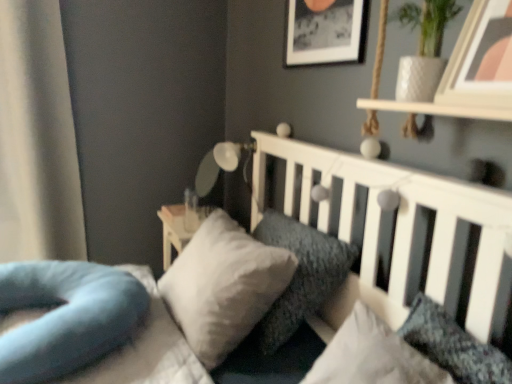
Question: Is white glossy lamp at upper center not close to soft gray pillow at center, which is counted as the 2th pillow, starting from the right?

Choices:
 (A) no
 (B) yes

Answer: (A)

Question: From the image's perspective, does white glossy lamp at upper center appear higher than soft gray pillow at center, arranged as the 3th pillow when viewed from the left?

Choices:
 (A) no
 (B) yes

Answer: (B)

Question: Does white glossy lamp at upper center have a lesser width compared to soft gray pillow at center, arranged as the 3th pillow when viewed from the left?

Choices:
 (A) no
 (B) yes

Answer: (B)

Question: Considering the relative sizes of white glossy lamp at upper center and soft gray pillow at center, which is counted as the 2th pillow, starting from the right, in the image provided, is white glossy lamp at upper center wider than soft gray pillow at center, which is counted as the 2th pillow, starting from the right,?

Choices:
 (A) no
 (B) yes

Answer: (A)

Question: Would you say white glossy lamp at upper center contains soft gray pillow at center, arranged as the 3th pillow when viewed from the left?

Choices:
 (A) no
 (B) yes

Answer: (A)

Question: Relative to soft blue pillow at lower left, the 4th pillow viewed from the right, is white soft bed at center in front or behind?

Choices:
 (A) behind
 (B) front

Answer: (B)

Question: From a real-world perspective, is white soft bed at center physically located above or below soft blue pillow at lower left, which appears as the first pillow when viewed from the left?

Choices:
 (A) above
 (B) below

Answer: (A)

Question: From the image's perspective, is white soft bed at center above or below soft blue pillow at lower left, which appears as the first pillow when viewed from the left?

Choices:
 (A) above
 (B) below

Answer: (A)

Question: Choose the correct answer: Is white soft bed at center inside soft blue pillow at lower left, which appears as the first pillow when viewed from the left, or outside it?

Choices:
 (A) inside
 (B) outside

Answer: (B)

Question: Looking at their shapes, would you say wooden picture frame at upper right, marked as the second picture frame in a left-to-right arrangement, is wider or thinner than textured gray pillow at center, positioned as the 1th pillow in right-to-left order?

Choices:
 (A) wide
 (B) thin

Answer: (B)

Question: From a real-world perspective, is wooden picture frame at upper right, the 1th picture frame when ordered from bottom to top, positioned above or below textured gray pillow at center, positioned as the 1th pillow in right-to-left order?

Choices:
 (A) below
 (B) above

Answer: (B)

Question: Which is correct: wooden picture frame at upper right, positioned as the first picture frame in front-to-back order, is inside textured gray pillow at center, positioned as the 1th pillow in right-to-left order, or outside of it?

Choices:
 (A) inside
 (B) outside

Answer: (B)

Question: Visually, is wooden picture frame at upper right, marked as the second picture frame in a left-to-right arrangement, positioned to the left or to the right of textured gray pillow at center, the 4th pillow from the left?

Choices:
 (A) right
 (B) left

Answer: (A)

Question: Would you say black matte picture frame at upper center, the first picture frame positioned from the top, is to the left or to the right of white soft bed at center in the picture?

Choices:
 (A) left
 (B) right

Answer: (B)

Question: From a real-world perspective, is black matte picture frame at upper center, positioned as the second picture frame in right-to-left order, positioned above or below white soft bed at center?

Choices:
 (A) below
 (B) above

Answer: (B)